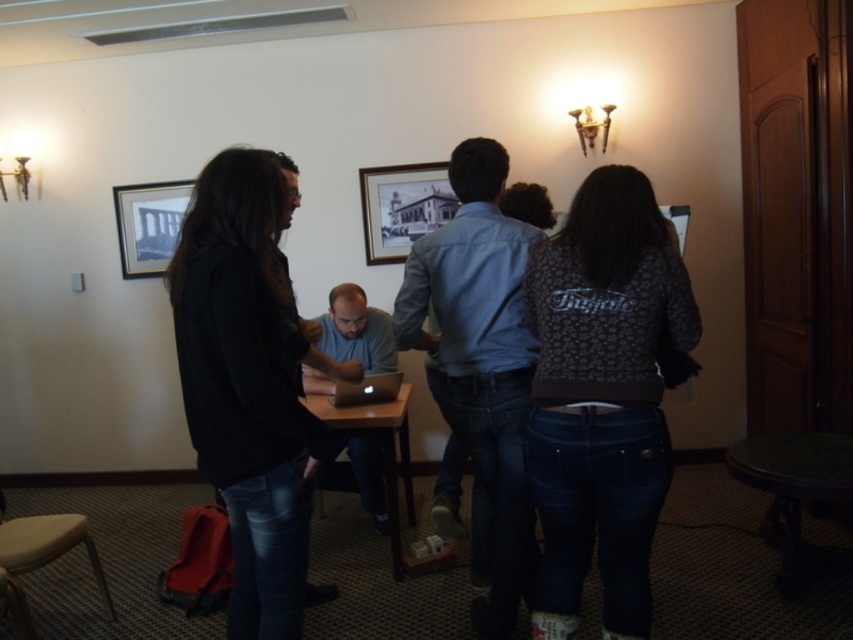
Question: Which object is positioned closest to the wooden framed picture at center?

Choices:
 (A) green polished wood table at lower right
 (B) matte gray shirt at center
 (C) black matte jacket at left

Answer: (B)

Question: Does patterned fabric jacket at back right have a smaller size compared to green polished wood table at lower right?

Choices:
 (A) no
 (B) yes

Answer: (B)

Question: Among these points, which one is farthest from the camera?

Choices:
 (A) pyautogui.click(x=360, y=440)
 (B) pyautogui.click(x=129, y=216)
 (C) pyautogui.click(x=408, y=384)

Answer: (B)

Question: Does patterned fabric jacket at back right appear over gold-framed picture at upper left?

Choices:
 (A) yes
 (B) no

Answer: (B)

Question: Where is wooden framed picture at center located in relation to wooden table at center in the image?

Choices:
 (A) above
 (B) below

Answer: (A)

Question: Which is nearer to the green polished wood table at lower right?

Choices:
 (A) black matte jacket at left
 (B) wooden framed picture at center
 (C) matte gray shirt at center

Answer: (C)